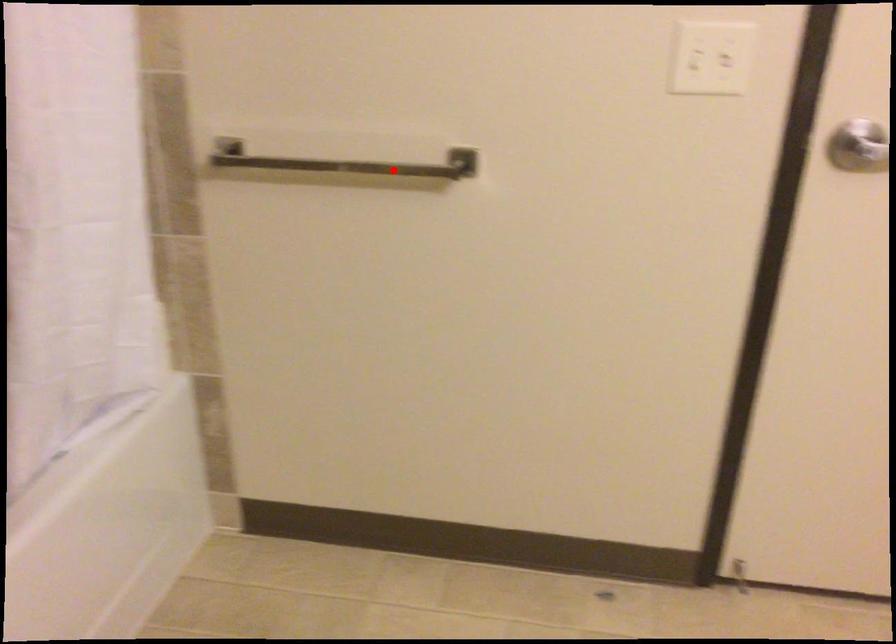
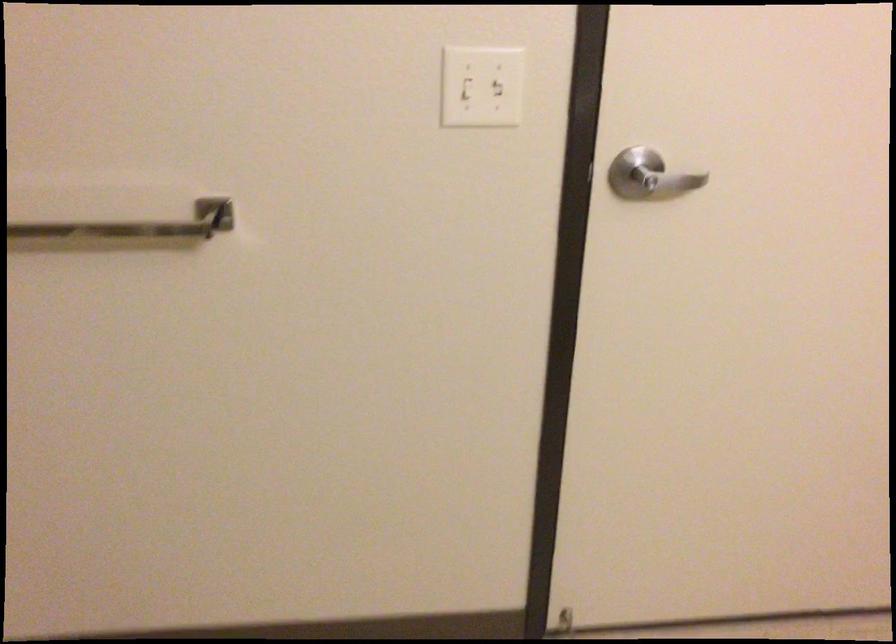
Question: A red point is marked in image1. In image2, is the corresponding 3D point closer to the camera or farther? Reply with the corresponding letter.

Choices:
 (A) The corresponding 3D point is closer.
 (B) The corresponding 3D point is farther.

Answer: (A)